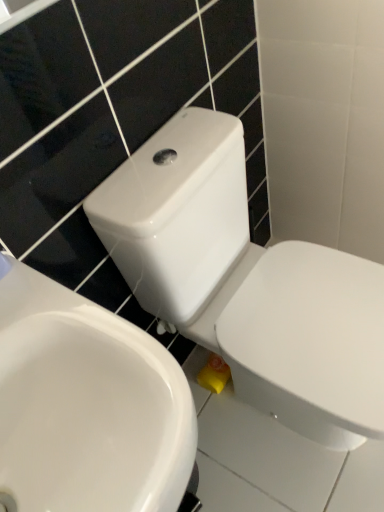
Question: Does white glossy sink at center have a greater width compared to white glossy toilet at center?

Choices:
 (A) no
 (B) yes

Answer: (A)

Question: Can you confirm if white glossy sink at center is positioned to the left of white glossy toilet at center?

Choices:
 (A) no
 (B) yes

Answer: (B)

Question: Is white glossy sink at center at the right side of white glossy toilet at center?

Choices:
 (A) no
 (B) yes

Answer: (A)

Question: Considering the relative sizes of white glossy sink at center and white glossy toilet at center in the image provided, is white glossy sink at center shorter than white glossy toilet at center?

Choices:
 (A) yes
 (B) no

Answer: (A)

Question: Considering the relative sizes of white glossy sink at center and white glossy toilet at center in the image provided, is white glossy sink at center thinner than white glossy toilet at center?

Choices:
 (A) no
 (B) yes

Answer: (B)

Question: Is white glossy sink at center facing towards white glossy toilet at center?

Choices:
 (A) yes
 (B) no

Answer: (B)

Question: From a real-world perspective, is white glossy toilet at center beneath white glossy sink at center?

Choices:
 (A) yes
 (B) no

Answer: (A)

Question: Is white glossy toilet at center next to white glossy sink at center?

Choices:
 (A) yes
 (B) no

Answer: (B)

Question: Can you confirm if white glossy toilet at center is thinner than white glossy sink at center?

Choices:
 (A) no
 (B) yes

Answer: (A)

Question: Is white glossy sink at center at the back of white glossy toilet at center?

Choices:
 (A) no
 (B) yes

Answer: (A)

Question: Is white glossy toilet at center to the left of white glossy sink at center from the viewer's perspective?

Choices:
 (A) no
 (B) yes

Answer: (A)

Question: Considering the relative sizes of white glossy toilet at center and white glossy sink at center in the image provided, is white glossy toilet at center smaller than white glossy sink at center?

Choices:
 (A) yes
 (B) no

Answer: (B)

Question: Considering the positions of white glossy toilet at center and white glossy sink at center in the image, is white glossy toilet at center bigger or smaller than white glossy sink at center?

Choices:
 (A) small
 (B) big

Answer: (B)